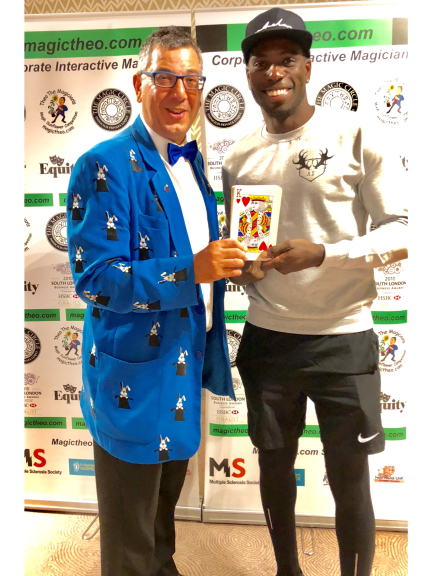
This screenshot has height=576, width=432. I want to click on backdrop, so click(x=236, y=445).